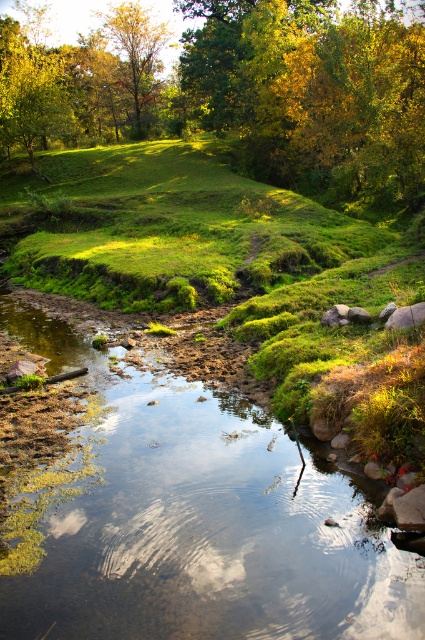
Does clear water stream at center appear under golden yellow leaves at upper center?

Correct, clear water stream at center is located below golden yellow leaves at upper center.

Which is more to the left, clear water stream at center or golden yellow leaves at upper center?

golden yellow leaves at upper center

The height and width of the screenshot is (640, 425). Find the location of `clear water stream at center`. clear water stream at center is located at coordinates (201, 524).

Is clear water stream at center taller than green leafy tree at upper center?

No, clear water stream at center is not taller than green leafy tree at upper center.

Does clear water stream at center have a larger size compared to green leafy tree at upper center?

No.

The image size is (425, 640). Describe the element at coordinates (201, 524) in the screenshot. I see `clear water stream at center` at that location.

I want to click on clear water stream at center, so click(201, 524).

Which is in front, point (277, 90) or point (146, 84)?

Point (277, 90) is in front.

Looking at this image, is green leafy tree at upper center to the right of golden yellow leaves at upper center from the viewer's perspective?

Yes, green leafy tree at upper center is to the right of golden yellow leaves at upper center.

Where is `green leafy tree at upper center`? This screenshot has width=425, height=640. green leafy tree at upper center is located at coordinates (314, 92).

This screenshot has height=640, width=425. Find the location of `green leafy tree at upper center`. green leafy tree at upper center is located at coordinates coord(314,92).